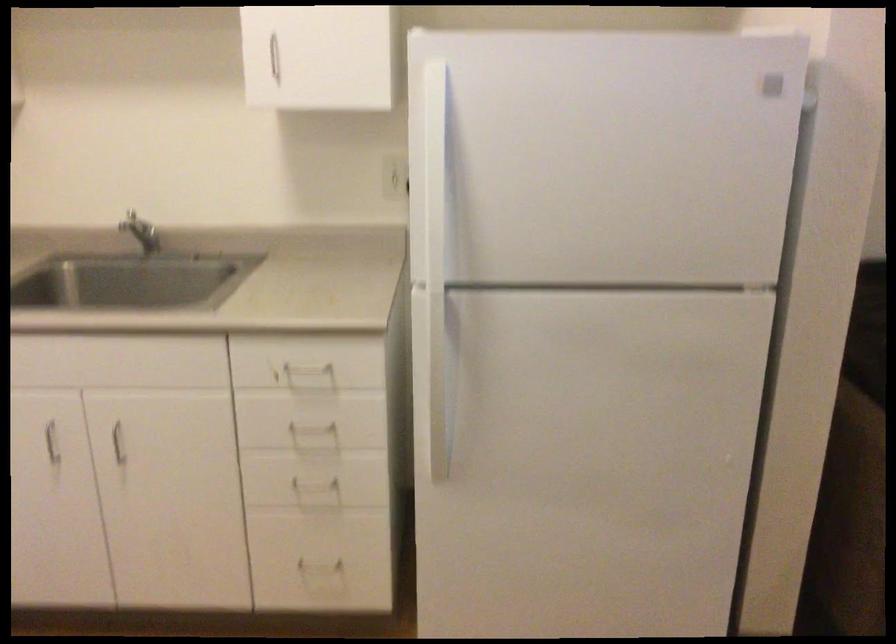
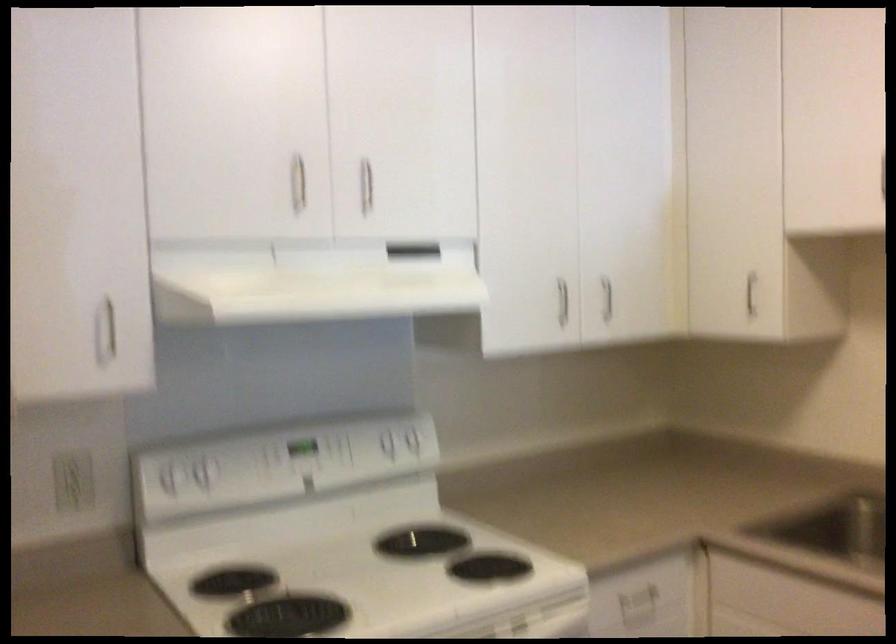
Question: How did the camera likely rotate?

Choices:
 (A) Left
 (B) Right
 (C) Up
 (D) Down

Answer: (A)